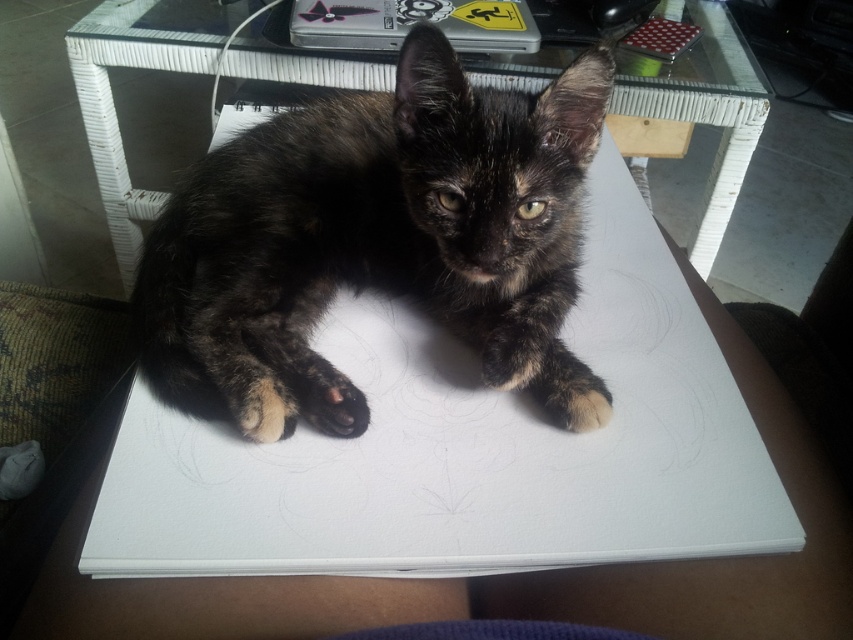
You have a small toy that is 5 cm wide. You want to place it on the transparent glass table at center without it overlapping the dark brown fur paw at center. Is there enough space on the table?

The transparent glass table at center is wider than the dark brown fur paw at center, so there should be enough space to place the 5 cm wide toy without overlapping the paw.

You are an interior designer assessing the layout of a room. You notice the dark tortoiseshell fur at center and the transparent glass table at center. Which object is located to the left of the other?

The dark tortoiseshell fur at center is positioned on the left side of transparent glass table at center.